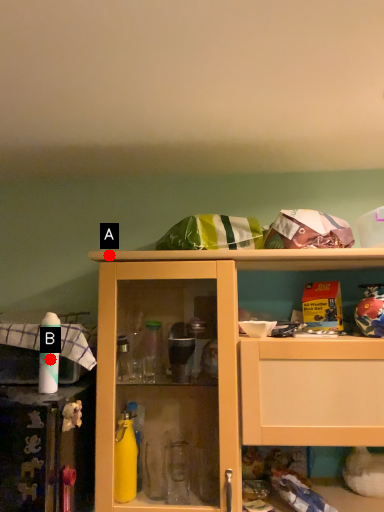
Question: Two points are circled on the image, labeled by A and B beside each circle. Among these points, which one is farthest from the camera?

Choices:
 (A) A is further
 (B) B is further

Answer: (A)